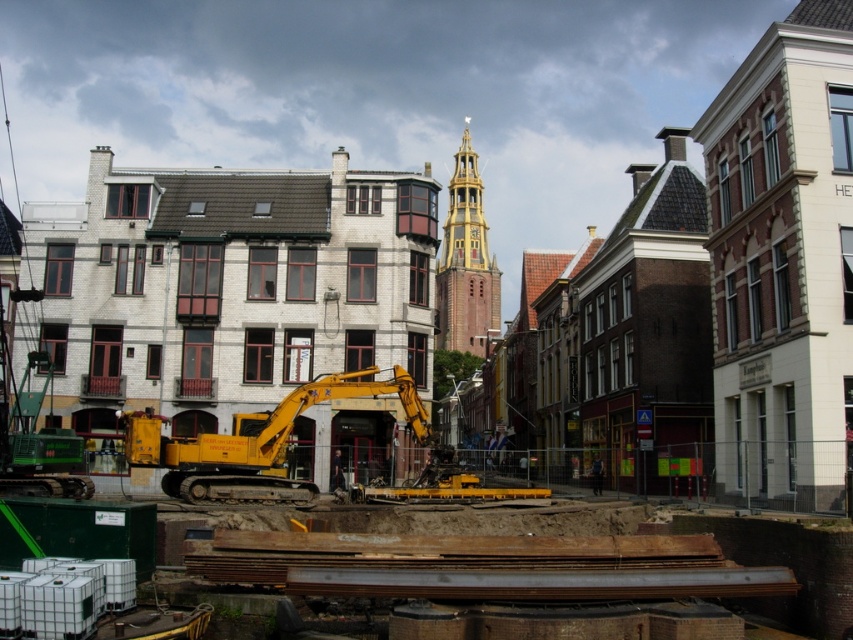
Can you confirm if yellow metallic excavator at center is smaller than gold textured clock tower at center?

Indeed, yellow metallic excavator at center has a smaller size compared to gold textured clock tower at center.

The height and width of the screenshot is (640, 853). What do you see at coordinates (286, 449) in the screenshot?
I see `yellow metallic excavator at center` at bounding box center [286, 449].

Where is `yellow metallic excavator at center`? The height and width of the screenshot is (640, 853). yellow metallic excavator at center is located at coordinates (286, 449).